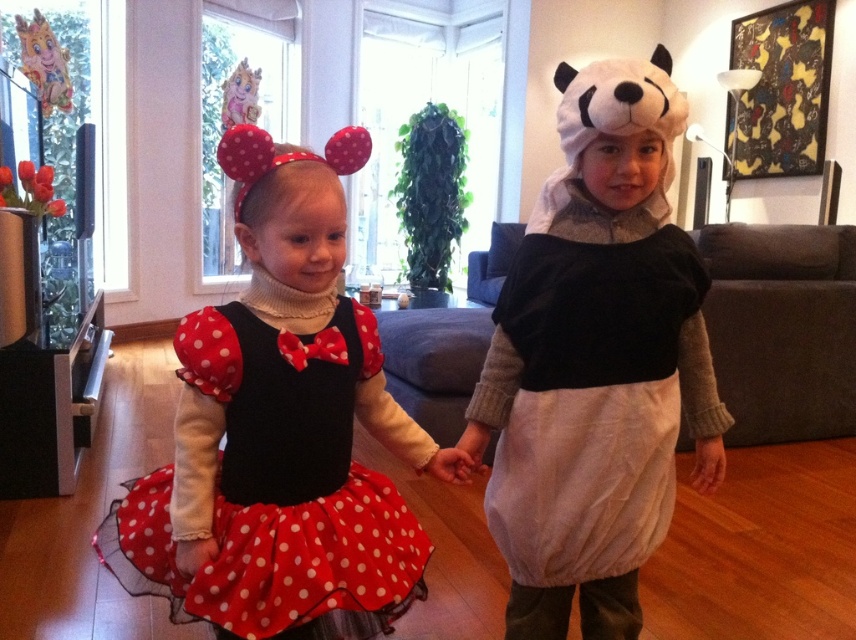
You are a photographer setting up for a Halloween party. You need to decide whether the red polka dot tulle dress at center will be visible above the paper cutout animal at upper left. Based on their heights, can you determine this?

The red polka dot tulle dress at center is shorter than the paper cutout animal at upper left, so it will not be visible above the paper cutout animal at upper left.

You are a photographer taking a picture of the two children in the living room. You notice two specific points in the scene at coordinates point (421, 445) and point (224, 93). Which of these points is closer to your camera lens?

Point (421, 445) is closer to the camera lens than point (224, 93).

You are a photographer setting up for a family photo. You see the white cotton dress at center and the pastel pink plush toy at upper left. Where should you position your camera to ensure both objects are in the frame?

Position the camera so it can capture both the white cotton dress at center and the pastel pink plush toy at upper left. Since the white cotton dress at center is located below the pastel pink plush toy at upper left, adjusting the camera angle downward slightly will ensure both are visible in the frame.